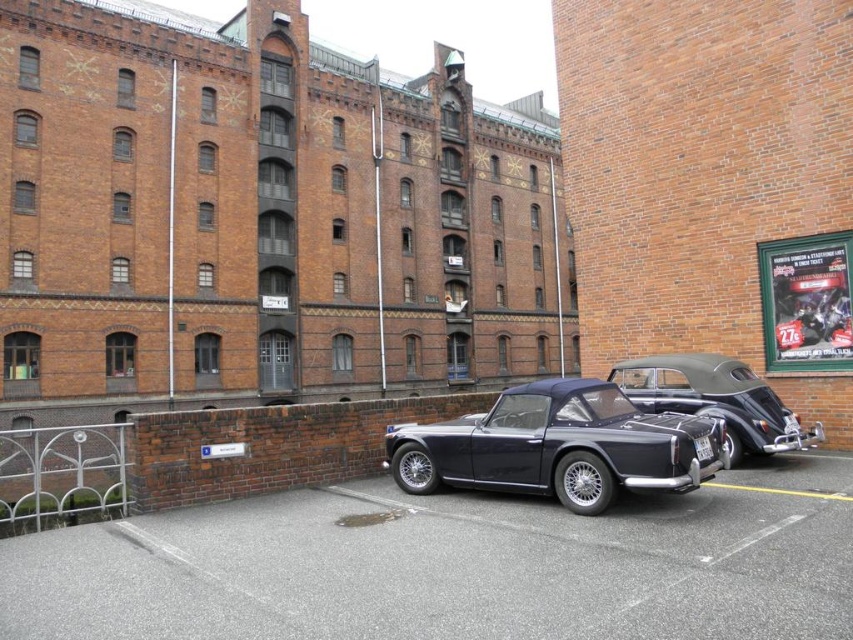
Question: Estimate the real-world distances between objects in this image. Which object is closer to the shiny black convertible at center?

Choices:
 (A) satin black convertible at center
 (B) black asphalt parking lot at center

Answer: (A)

Question: Which of the following is the closest to the observer?

Choices:
 (A) (398, 492)
 (B) (735, 403)

Answer: (A)

Question: Which point is closer to the camera?

Choices:
 (A) shiny black convertible at center
 (B) black asphalt parking lot at center
 (C) satin black convertible at center

Answer: (B)

Question: Can you confirm if satin black convertible at center is bigger than shiny black convertible at center?

Choices:
 (A) no
 (B) yes

Answer: (B)

Question: Does black asphalt parking lot at center have a smaller size compared to shiny black convertible at center?

Choices:
 (A) no
 (B) yes

Answer: (A)

Question: Does black asphalt parking lot at center have a smaller size compared to satin black convertible at center?

Choices:
 (A) yes
 (B) no

Answer: (A)